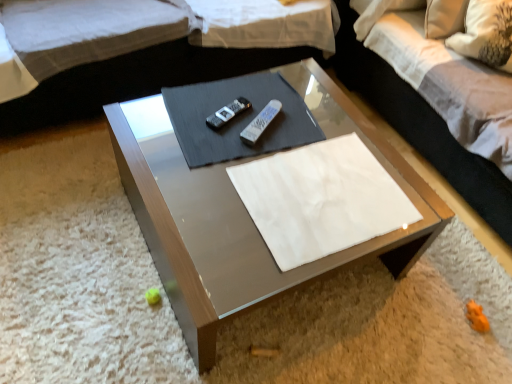
Where is `vacant space behind white paper at center`? The height and width of the screenshot is (384, 512). vacant space behind white paper at center is located at coordinates (307, 110).